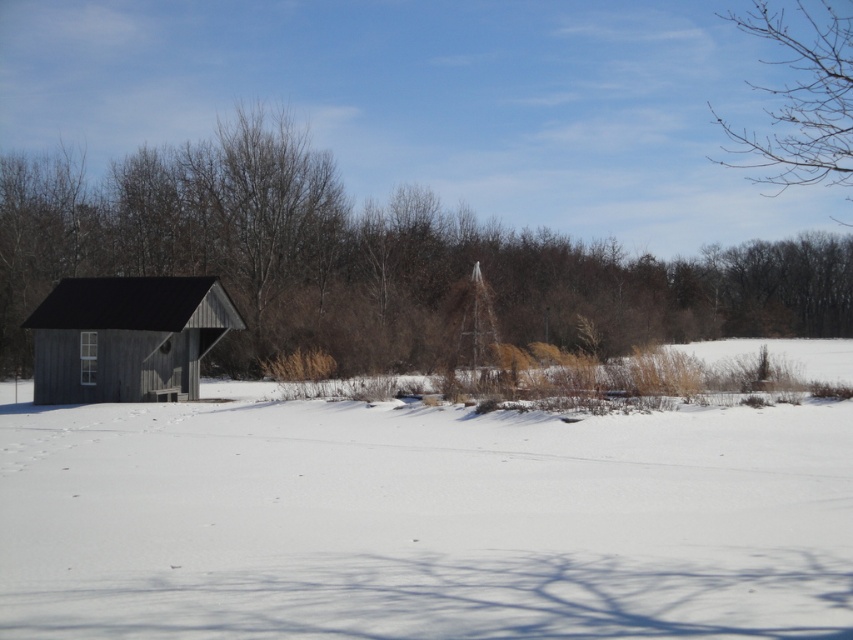
Who is shorter, white fluffy snow at center or wooden cabin at left?

Standing shorter between the two is wooden cabin at left.

Which of these two, white fluffy snow at center or wooden cabin at left, stands taller?

white fluffy snow at center

This screenshot has width=853, height=640. I want to click on white fluffy snow at center, so [422, 520].

Find the location of a particular element. white fluffy snow at center is located at coordinates (422, 520).

The height and width of the screenshot is (640, 853). What do you see at coordinates (422, 520) in the screenshot?
I see `white fluffy snow at center` at bounding box center [422, 520].

Is white fluffy snow at center positioned at the back of smooth gray wood cabin at left?

No, it is not.

Locate an element on the screen. white fluffy snow at center is located at coordinates (422, 520).

Measure the distance between smooth gray wood cabin at left and camera.

A distance of 48.52 meters exists between smooth gray wood cabin at left and camera.

Is smooth gray wood cabin at left smaller than wooden cabin at left?

No.

Is point (532, 257) farther from viewer compared to point (236, 324)?

Yes, it is.

Identify the location of smooth gray wood cabin at left. (374, 259).